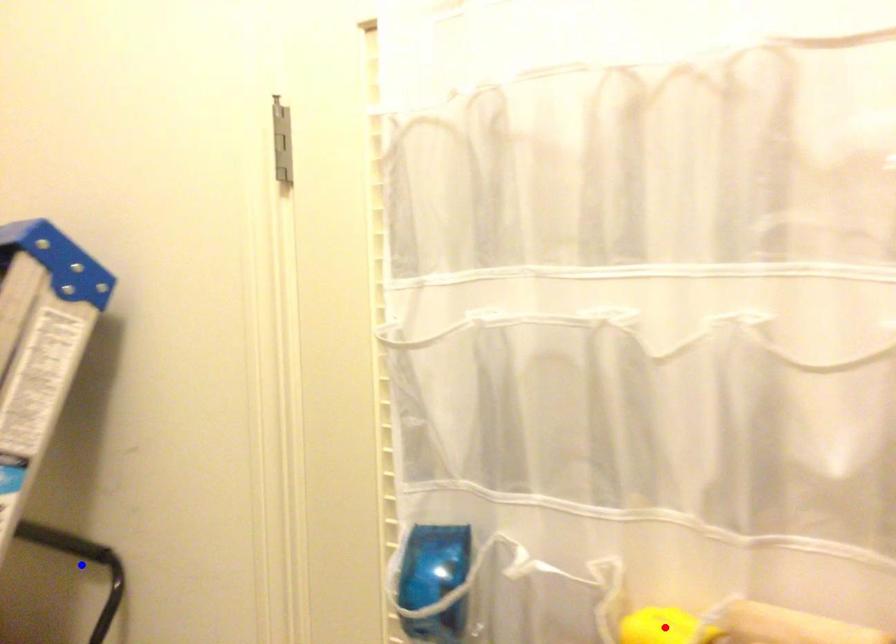
Question: In the image, two points are highlighted. Which point is nearer to the camera? Reply with the corresponding letter.

Choices:
 (A) blue point
 (B) red point

Answer: (B)